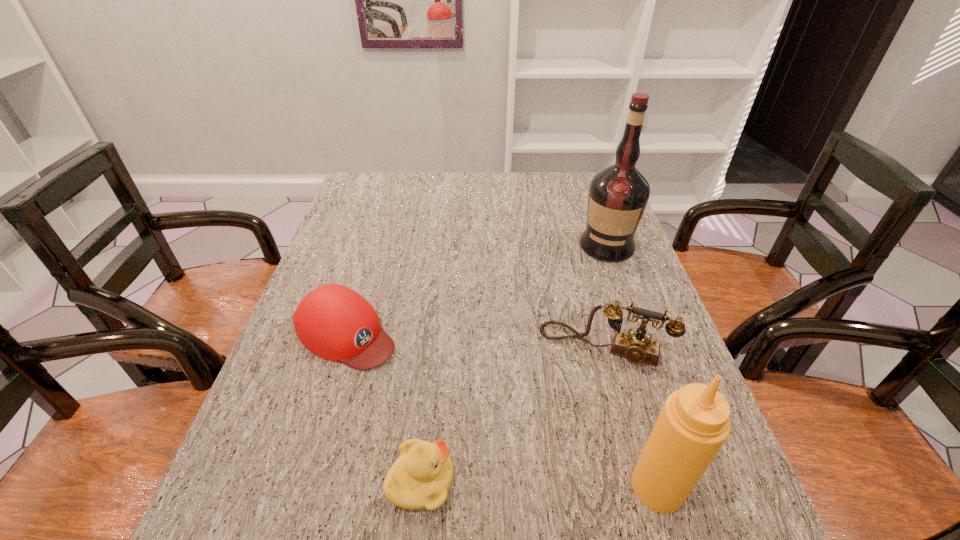
You are a GUI agent. You are given a task and a screenshot of the screen. Output one action in this format:
    pyautogui.click(x=<x>, y=<y>)
    Task: Click on the condiment situated at the right edge
    This screenshot has height=540, width=960.
    Given the screenshot: What is the action you would take?
    click(x=694, y=423)

At what (x,y) coordinates should I click in order to perform the action: click on telephone located in the right edge section of the desktop. Please return your answer as a coordinate pair (x, y). Looking at the image, I should click on (636, 347).

At what (x,y) coordinates should I click in order to perform the action: click on liquor that is at the right edge. Please return your answer as a coordinate pair (x, y). This screenshot has height=540, width=960. Looking at the image, I should click on (618, 195).

Find the location of a particular element. This screenshot has height=540, width=960. object that is at the near right corner is located at coordinates (694, 423).

Find the location of a particular element. The width and height of the screenshot is (960, 540). vacant space at the far edge of the desktop is located at coordinates (526, 176).

Locate an element on the screen. This screenshot has width=960, height=540. vacant space at the right edge is located at coordinates (657, 333).

At what (x,y) coordinates should I click in order to perform the action: click on free space at the far left corner. Please return your answer as a coordinate pair (x, y). The width and height of the screenshot is (960, 540). Looking at the image, I should click on (396, 194).

Find the location of a particular element. empty space between the fourth object from right to left and the condiment is located at coordinates (540, 484).

Where is `vacant area between the tallest object and the baseball cap`? This screenshot has width=960, height=540. vacant area between the tallest object and the baseball cap is located at coordinates (476, 289).

Image resolution: width=960 pixels, height=540 pixels. In order to click on vacant area between the baseball cap and the duckling in this screenshot , I will do `click(384, 407)`.